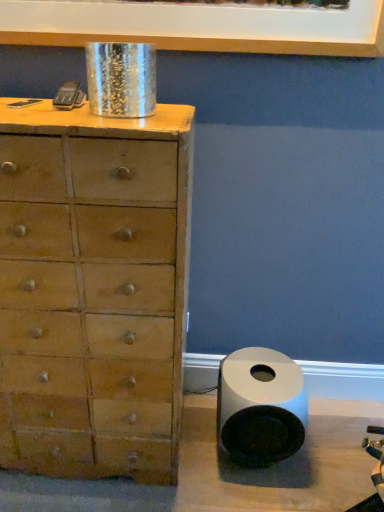
Question: From a real-world perspective, does white glossy speaker at lower right stand above wooden chest of drawers at left?

Choices:
 (A) no
 (B) yes

Answer: (A)

Question: Does white glossy speaker at lower right have a smaller size compared to wooden chest of drawers at left?

Choices:
 (A) no
 (B) yes

Answer: (B)

Question: Are white glossy speaker at lower right and wooden chest of drawers at left located far from each other?

Choices:
 (A) yes
 (B) no

Answer: (B)

Question: From the image's perspective, is white glossy speaker at lower right above wooden chest of drawers at left?

Choices:
 (A) no
 (B) yes

Answer: (A)

Question: Is wooden chest of drawers at left completely or partially inside white glossy speaker at lower right?

Choices:
 (A) yes
 (B) no

Answer: (B)

Question: From a real-world perspective, does white glossy speaker at lower right sit lower than wooden chest of drawers at left?

Choices:
 (A) no
 (B) yes

Answer: (B)

Question: Does wooden chest of drawers at left have a larger size compared to white glossy picture frame at upper center?

Choices:
 (A) no
 (B) yes

Answer: (B)

Question: Is wooden chest of drawers at left positioned in front of white glossy picture frame at upper center?

Choices:
 (A) yes
 (B) no

Answer: (A)

Question: Could you tell me if wooden chest of drawers at left is turned towards white glossy picture frame at upper center?

Choices:
 (A) no
 (B) yes

Answer: (A)

Question: From the image's perspective, would you say wooden chest of drawers at left is shown under white glossy picture frame at upper center?

Choices:
 (A) yes
 (B) no

Answer: (A)

Question: Does wooden chest of drawers at left have a lesser height compared to white glossy picture frame at upper center?

Choices:
 (A) yes
 (B) no

Answer: (B)

Question: From a real-world perspective, is wooden chest of drawers at left physically below white glossy picture frame at upper center?

Choices:
 (A) no
 (B) yes

Answer: (B)

Question: Is wooden chest of drawers at left placed right next to white glossy speaker at lower right?

Choices:
 (A) no
 (B) yes

Answer: (A)